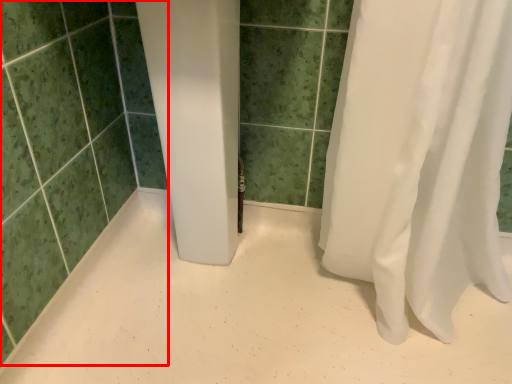
Question: In this image, where is ceramic tile (annotated by the red box) located relative to plain?

Choices:
 (A) left
 (B) right

Answer: (A)